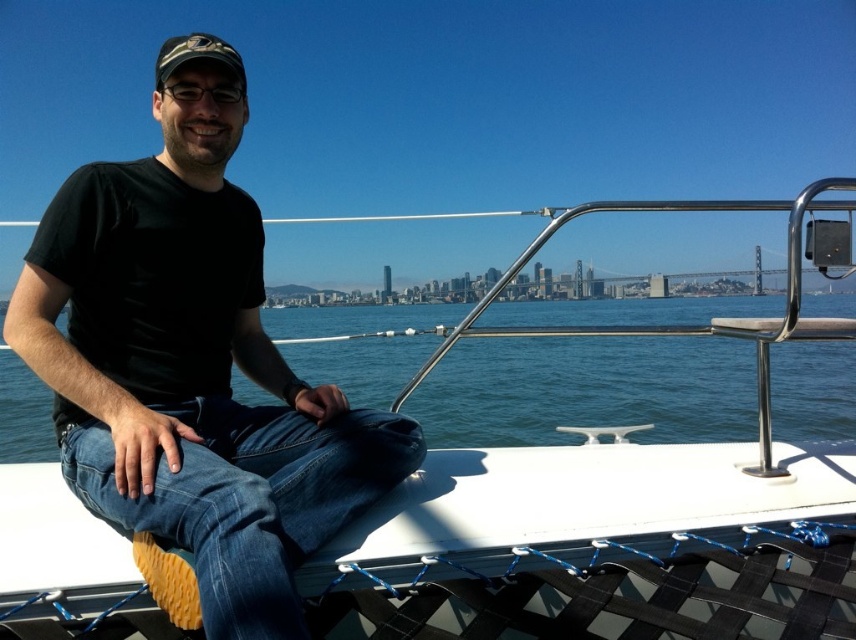
What do you see at coordinates (192, 369) in the screenshot? I see `black matte t-shirt at upper left` at bounding box center [192, 369].

Based on the photo, who is higher up, black matte t-shirt at upper left or blue water at center?

blue water at center

Does point (87, 378) lie in front of point (827, 429)?

Yes, it is in front of point (827, 429).

Locate an element on the screen. black matte t-shirt at upper left is located at coordinates (192, 369).

Is point (550, 490) less distant than point (616, 396)?

Yes, point (550, 490) is in front of point (616, 396).

Does point (679, 472) come farther from viewer compared to point (378, 307)?

No, it is not.

This screenshot has width=856, height=640. Find the location of `white matte boat at center`. white matte boat at center is located at coordinates (613, 506).

Is black matte t-shirt at upper left positioned in front of camouflage fabric baseball cap at upper left?

Yes, it is.

The width and height of the screenshot is (856, 640). What do you see at coordinates (192, 369) in the screenshot?
I see `black matte t-shirt at upper left` at bounding box center [192, 369].

Find the location of a particular element. The width and height of the screenshot is (856, 640). black matte t-shirt at upper left is located at coordinates (192, 369).

You are a GUI agent. You are given a task and a screenshot of the screen. Output one action in this format:
    pyautogui.click(x=<x>, y=<y>)
    Task: Click on the black matte t-shirt at upper left
    The width and height of the screenshot is (856, 640).
    Given the screenshot: What is the action you would take?
    pyautogui.click(x=192, y=369)